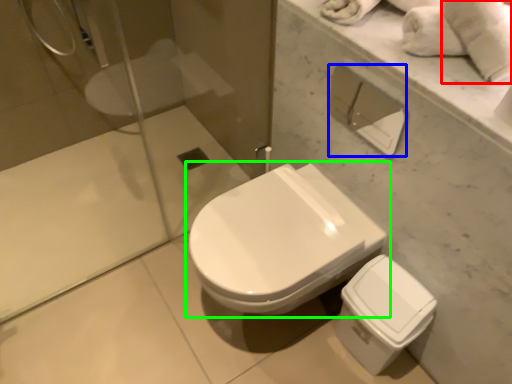
Question: Considering the real-world distances, which object is closest to bath towel (highlighted by a red box)? toilet paper (highlighted by a blue box) or toilet (highlighted by a green box).

Choices:
 (A) toilet paper
 (B) toilet

Answer: (B)